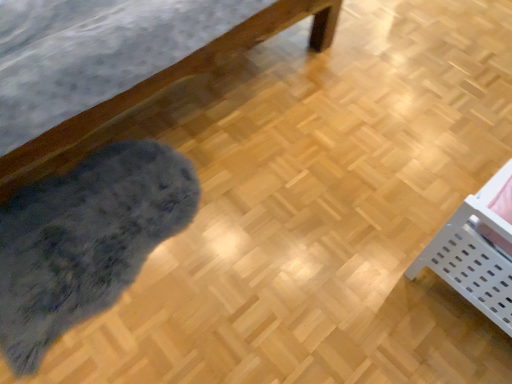
In order to click on free spot to the right of fuzzy gray mat at lower left in this screenshot , I will do `click(271, 244)`.